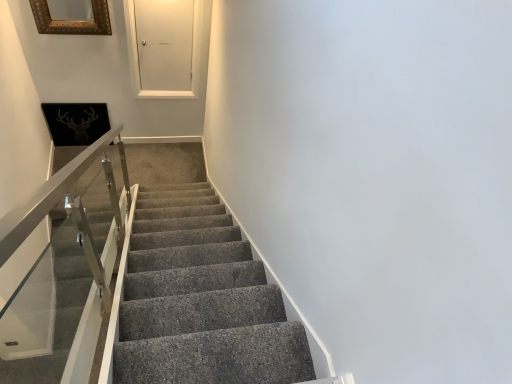
The height and width of the screenshot is (384, 512). What do you see at coordinates (164, 46) in the screenshot? I see `white matte door at upper center` at bounding box center [164, 46].

Find the location of `white matte door at upper center`. white matte door at upper center is located at coordinates (164, 46).

Measure the distance between point (191, 93) and camera.

They are 13.48 feet apart.

Where is `white matte door at upper center`? white matte door at upper center is located at coordinates (164, 46).